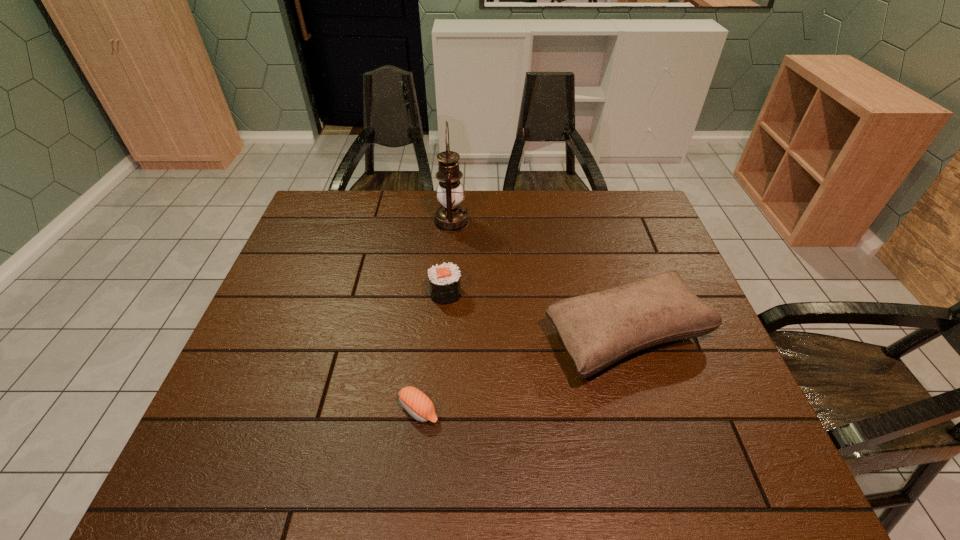
Locate which object is the second closest to the second shortest object. Please provide its 2D coordinates. Your answer should be formatted as a tuple, i.e. [(x, y)], where the tuple contains the x and y coordinates of a point satisfying the conditions above.

[(451, 217)]

You are a GUI agent. You are given a task and a screenshot of the screen. Output one action in this format:
    pyautogui.click(x=<x>, y=<y>)
    Task: Click on the object that ranks as the closest to the third tallest object
    The width and height of the screenshot is (960, 540).
    Given the screenshot: What is the action you would take?
    pyautogui.click(x=598, y=329)

Identify the location of vacant space that satisfies the following two spatial constraints: 1. on the front side of the oil lamp; 2. on the right side of the rightmost object. (443, 336).

Where is `free space that satisfies the following two spatial constraints: 1. on the back side of the oil lamp; 2. on the left side of the farther sushi`? The width and height of the screenshot is (960, 540). free space that satisfies the following two spatial constraints: 1. on the back side of the oil lamp; 2. on the left side of the farther sushi is located at coordinates (451, 222).

This screenshot has height=540, width=960. Find the location of `free space that satisfies the following two spatial constraints: 1. on the back side of the nearer sushi; 2. on the left side of the second tallest object`. free space that satisfies the following two spatial constraints: 1. on the back side of the nearer sushi; 2. on the left side of the second tallest object is located at coordinates [427, 336].